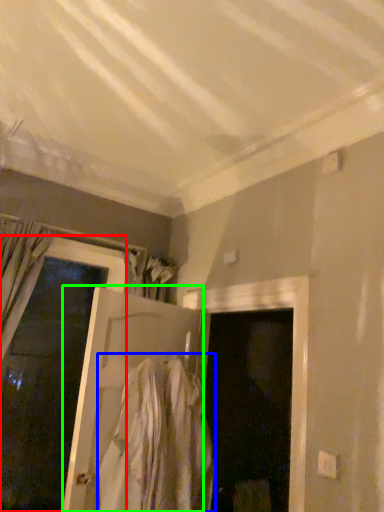
Question: Based on their relative distances, which object is nearer to door (highlighted by a red box)? Choose from clothing (highlighted by a blue box) and door (highlighted by a green box).

Choices:
 (A) clothing
 (B) door

Answer: (B)